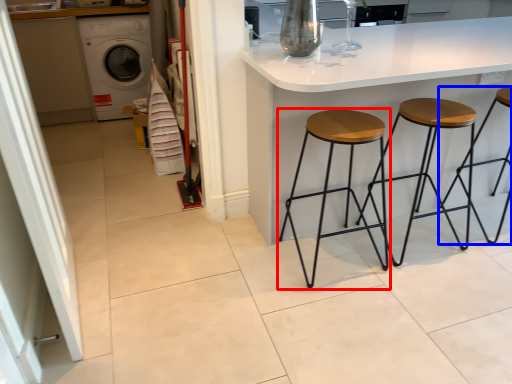
Question: Which point is closer to the camera, stool (highlighted by a red box) or stool (highlighted by a blue box)?

Choices:
 (A) stool
 (B) stool

Answer: (A)